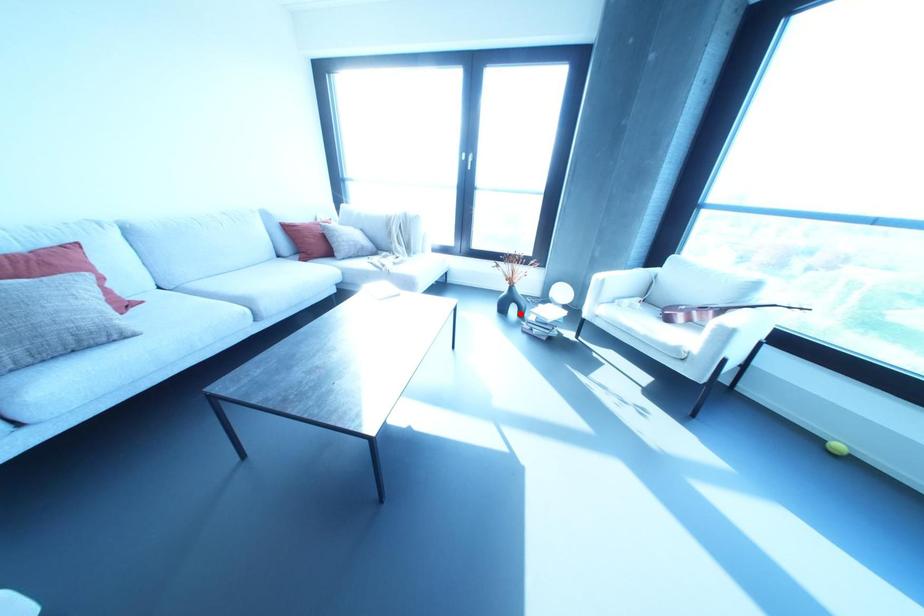
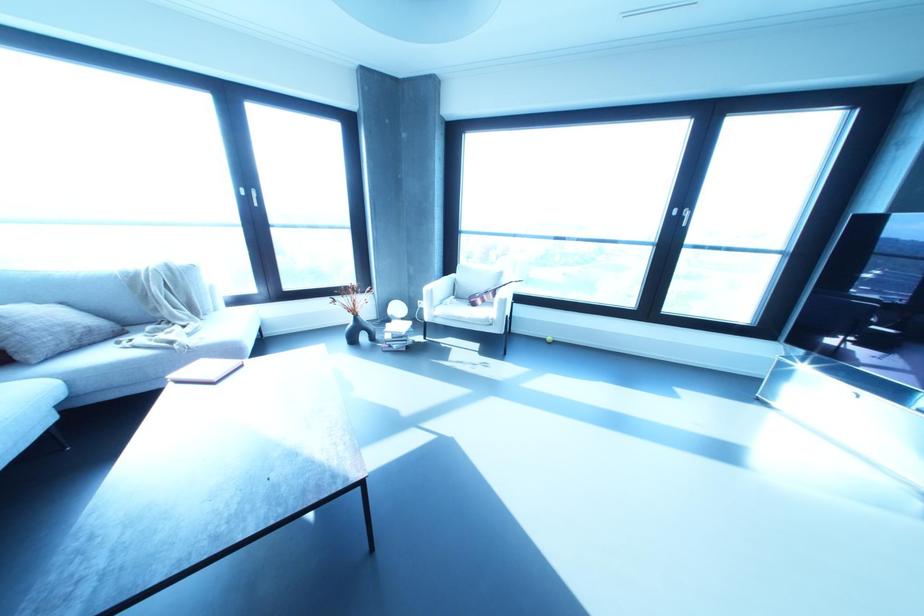
Question: I am providing you with two images of the same scene from different viewpoints. In image1, a red point is highlighted. Considering the same 3D point in image2, which of the following is correct?

Choices:
 (A) It is closer
 (B) It is farther

Answer: (B)